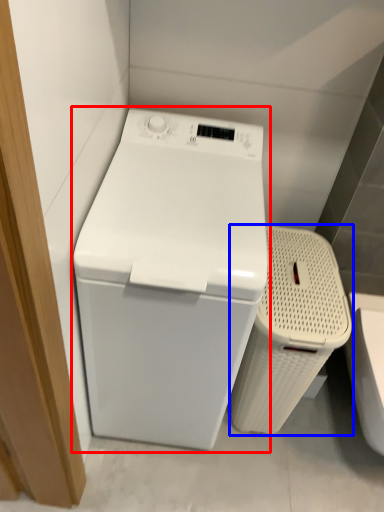
Question: Which point is further to the camera, washing machine (highlighted by a red box) or laundry basket (highlighted by a blue box)?

Choices:
 (A) washing machine
 (B) laundry basket

Answer: (B)